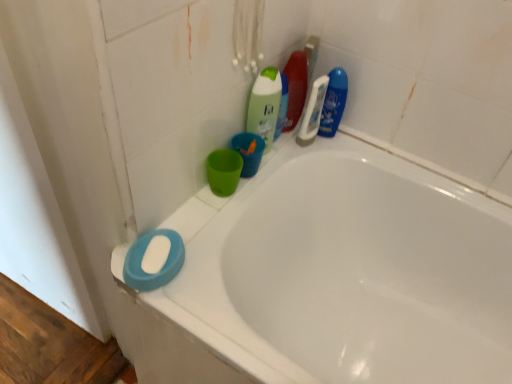
This screenshot has height=384, width=512. What are the coordinates of `free space in front of white plastic toothbrush at upper center, the second cleaning product when ordered from right to left` in the screenshot? It's located at (284, 166).